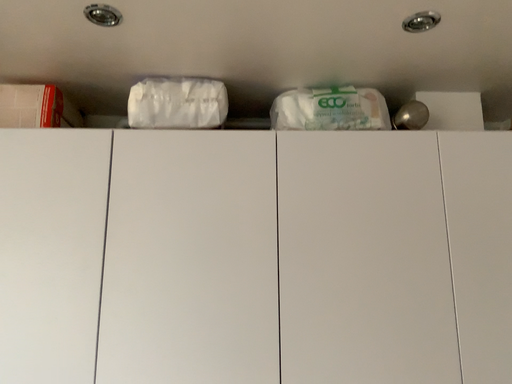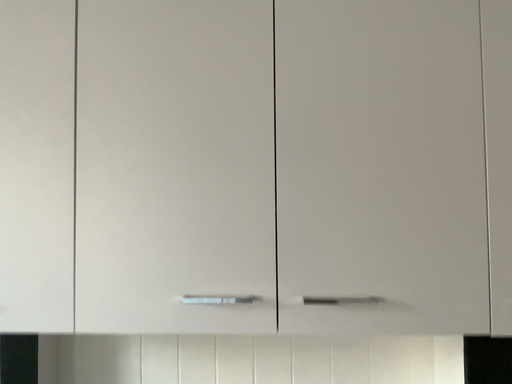
Question: How did the camera likely rotate when shooting the video?

Choices:
 (A) rotated downward
 (B) rotated upward

Answer: (A)